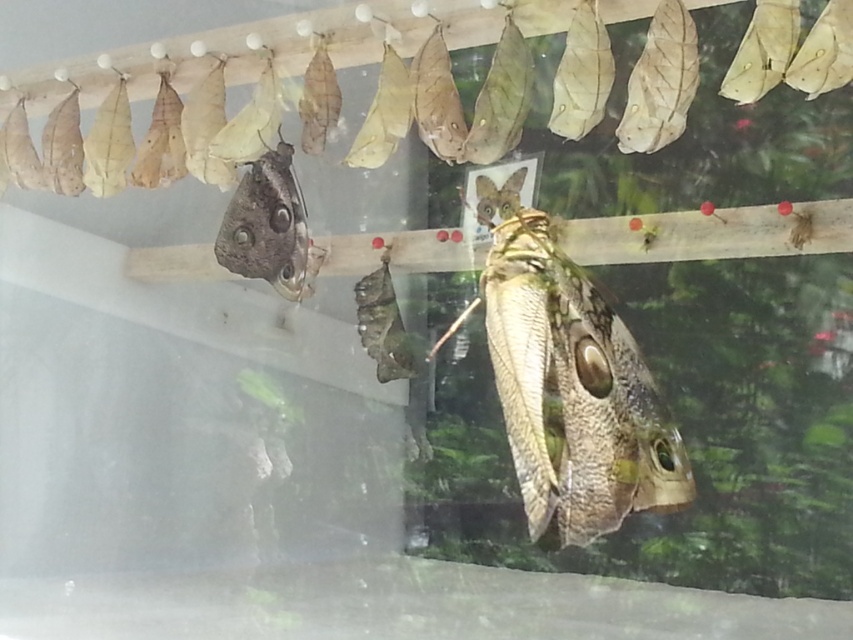
Does point (630, 468) lie in front of point (306, 289)?

Yes, point (630, 468) is closer to viewer.

Which of these two, brown textured butterfly at center or matte brown butterfly at upper left, stands shorter?

matte brown butterfly at upper left is shorter.

Is point (523, 493) farther from viewer compared to point (293, 170)?

That is False.

Where is `brown textured butterfly at center`? This screenshot has width=853, height=640. brown textured butterfly at center is located at coordinates (567, 384).